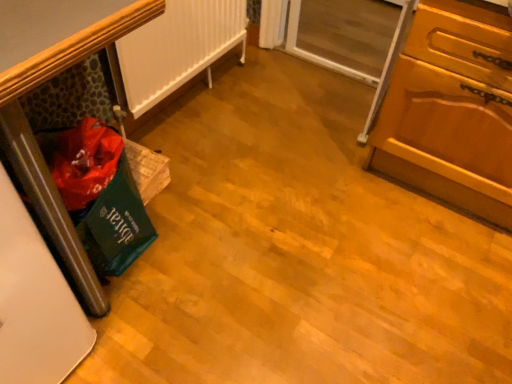
Locate an element on the screen. Image resolution: width=512 pixels, height=384 pixels. free space in front of white matte radiator at left is located at coordinates (211, 169).